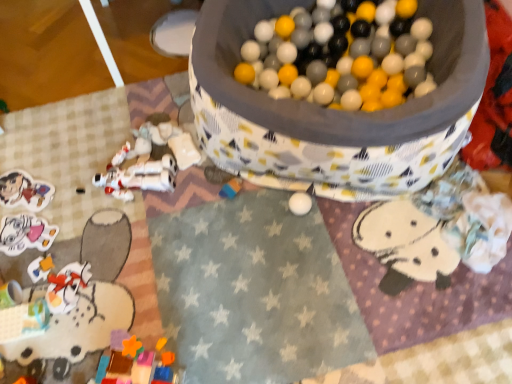
Identify the location of free spot in front of multicolored plastic blocks at center, the 2th toy positioned from the right. The height and width of the screenshot is (384, 512). (231, 236).